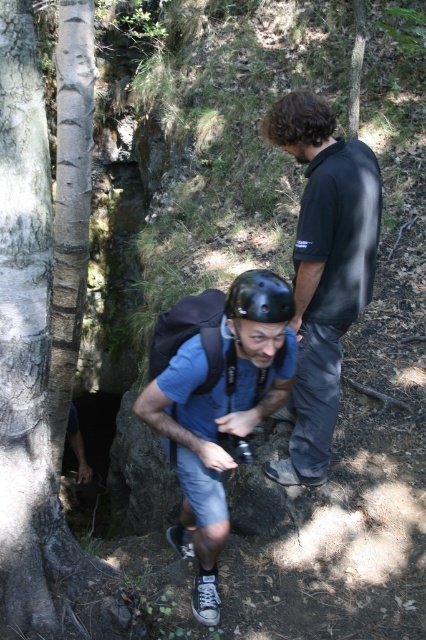
Between blue fabric helmet at center and black matte helmet at center, which one appears on the right side from the viewer's perspective?

From the viewer's perspective, black matte helmet at center appears more on the right side.

This screenshot has width=426, height=640. I want to click on blue fabric helmet at center, so pos(221,413).

The image size is (426, 640). I want to click on blue fabric helmet at center, so click(x=221, y=413).

Is black smooth shirt at upper center to the right of blue fabric helmet at center from the viewer's perspective?

Indeed, black smooth shirt at upper center is positioned on the right side of blue fabric helmet at center.

Find the location of a particular element. The width and height of the screenshot is (426, 640). black smooth shirt at upper center is located at coordinates (324, 269).

Can you confirm if smooth bark tree at left is taller than blue fabric helmet at center?

Yes.

Does smooth bark tree at left come in front of blue fabric helmet at center?

No, it is behind blue fabric helmet at center.

Find the location of `smooth bark tree at left`. smooth bark tree at left is located at coordinates (28, 346).